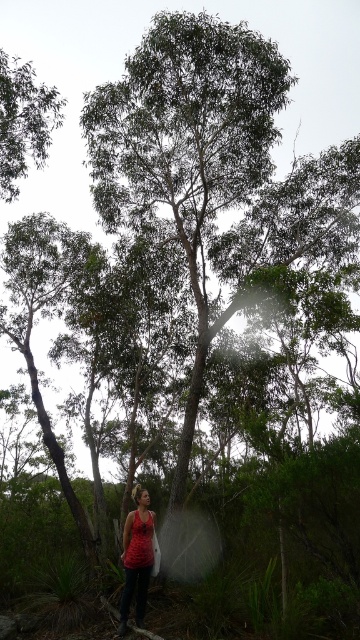
You are an observer in the forest scene. You notice the green leafy tree at upper left and the red fabric tank top at lower center. Which object occupies more horizontal space in the image?

The green leafy tree at upper left might be wider than the red fabric tank top at lower center.

You are standing at the base of the tall eucalyptus tree in the center and want to pick a leaf from the green leafy tree at upper left. Can you reach it without moving from your current position?

The green leafy tree at upper left is located at point (24, 122), which is outside your reach while standing at the base of the tall eucalyptus tree in the center. You would need to move closer to pick a leaf from it.